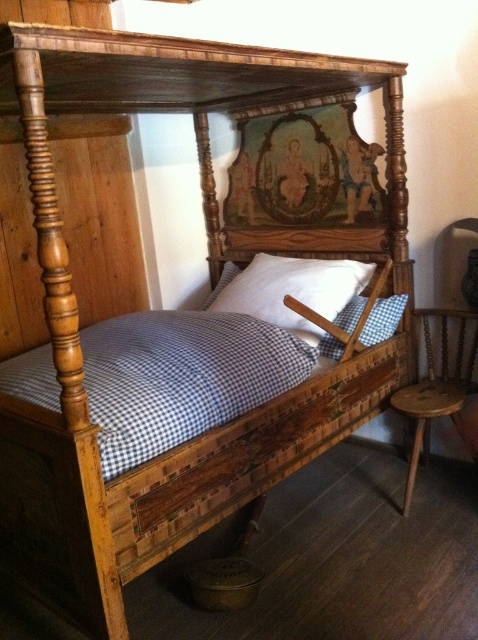
Is brown wooden chair at right shorter than white checkered pillow at center?

In fact, brown wooden chair at right may be taller than white checkered pillow at center.

Is brown wooden chair at right wider than white checkered pillow at center?

In fact, brown wooden chair at right might be narrower than white checkered pillow at center.

The width and height of the screenshot is (478, 640). Identify the location of brown wooden chair at right. (435, 392).

Find the location of `brown wooden chair at right`. brown wooden chair at right is located at coordinates (435, 392).

Where is `white matte pillow at center`? The height and width of the screenshot is (640, 478). white matte pillow at center is located at coordinates (293, 291).

The image size is (478, 640). What do you see at coordinates (293, 291) in the screenshot?
I see `white matte pillow at center` at bounding box center [293, 291].

You are a GUI agent. You are given a task and a screenshot of the screen. Output one action in this format:
    pyautogui.click(x=<x>, y=<y>)
    Task: Click on the white matte pillow at center
    The image size is (478, 640).
    Given the screenshot: What is the action you would take?
    (x=293, y=291)

Which is below, white matte pillow at center or brown wooden chair at right?

Positioned lower is brown wooden chair at right.

Is point (249, 268) more distant than point (423, 412)?

Yes.

Is point (321, 259) positioned behind point (414, 474)?

That is True.

Locate an element on the screen. white matte pillow at center is located at coordinates (293, 291).